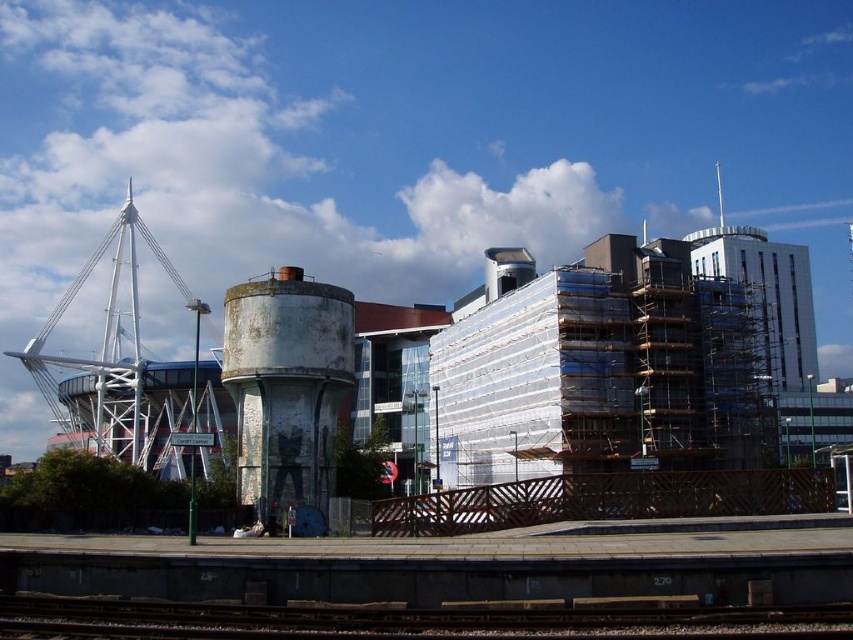
You are standing at the point marked by the coordinates point [287,390] in the image. What object are you standing on?

You are standing on the white concrete water tower at center left.

You are a bird flying over the urban landscape. You want to land on the tallest metallic structure between the metal at bottom and the white metallic structure at left. Which one should you choose?

The white metallic structure at left is taller than the metal at bottom, so you should choose the white metallic structure at left to land on.